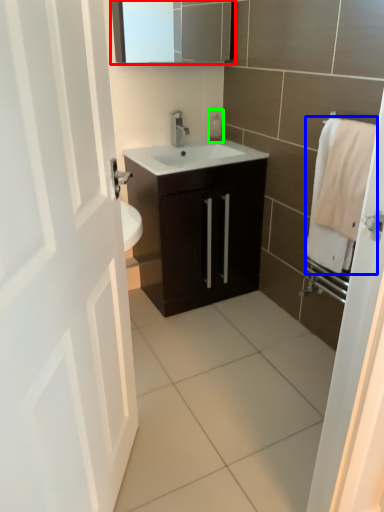
Question: Based on their relative distances, which object is farther from medicine cabinet (highlighted by a red box)? Choose from bath towel (highlighted by a blue box) and soap dispenser (highlighted by a green box).

Choices:
 (A) bath towel
 (B) soap dispenser

Answer: (A)